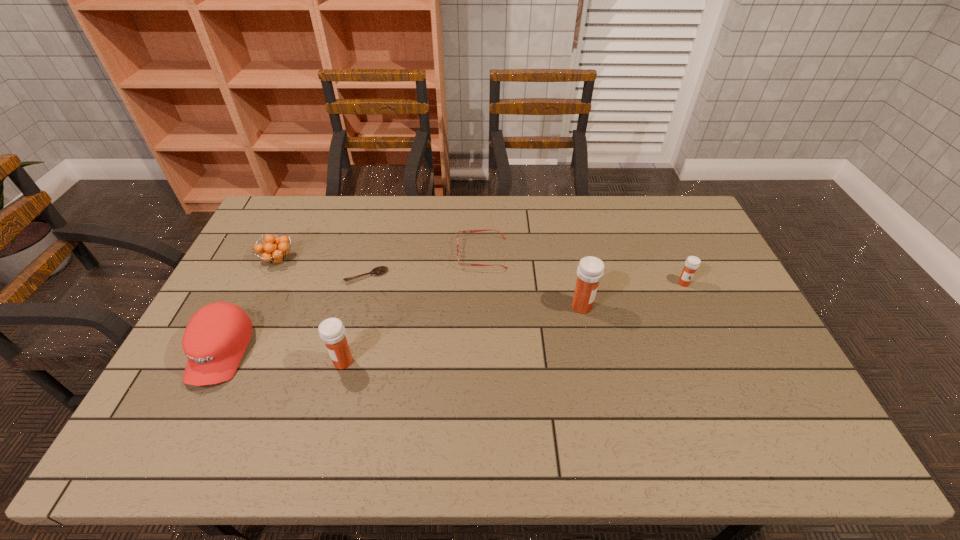
The height and width of the screenshot is (540, 960). Find the location of `cap`. cap is located at coordinates (215, 339).

Find the location of `vacant position located 0.110m on the label side of the second tallest object`. vacant position located 0.110m on the label side of the second tallest object is located at coordinates (291, 361).

Find the location of a particular element. This screenshot has width=960, height=540. vacant space located on the label side of the second tallest object is located at coordinates (279, 361).

In order to click on free space located 0.320m on the label side of the second tallest object in this screenshot , I will do `click(213, 361)`.

Identify the location of vacant space located 0.140m on the label side of the fifth farthest object. The image size is (960, 540). (640, 307).

I want to click on free region located on the label side of the rightmost medicine, so click(697, 312).

The image size is (960, 540). In order to click on free space located on the lenses of the spectacles in this screenshot , I will do `click(366, 253)`.

The height and width of the screenshot is (540, 960). I want to click on free location located 0.080m on the lenses of the spectacles, so click(433, 253).

Find the location of a particular element. The width and height of the screenshot is (960, 540). blank space located 0.330m on the lenses of the spectacles is located at coordinates (360, 253).

Find the location of a particular element. The image size is (960, 540). vacant space located on the back of the orange fruit is located at coordinates (295, 225).